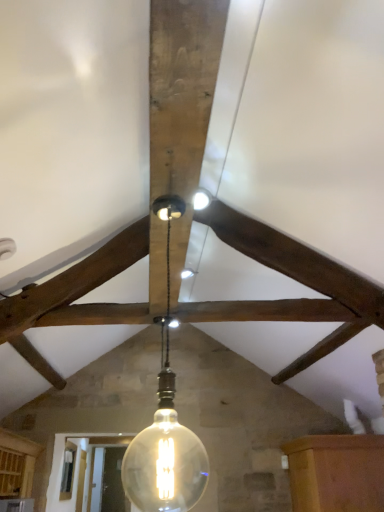
Describe the element at coordinates (165, 426) in the screenshot. I see `translucent glass bulb at center` at that location.

You are a GUI agent. You are given a task and a screenshot of the screen. Output one action in this format:
    pyautogui.click(x=<x>, y=<y>)
    Task: Click on the translucent glass bulb at center
    This screenshot has width=384, height=512.
    Given the screenshot: What is the action you would take?
    pyautogui.click(x=165, y=426)

Where is `translucent glass bulb at center`? translucent glass bulb at center is located at coordinates (165, 426).